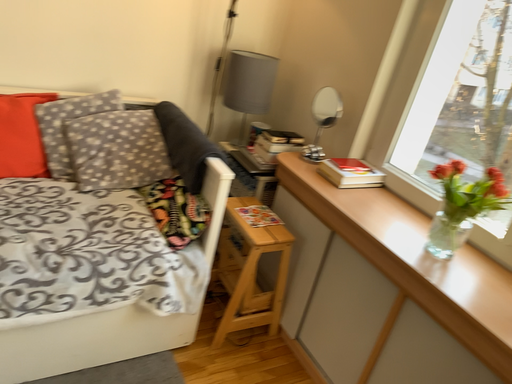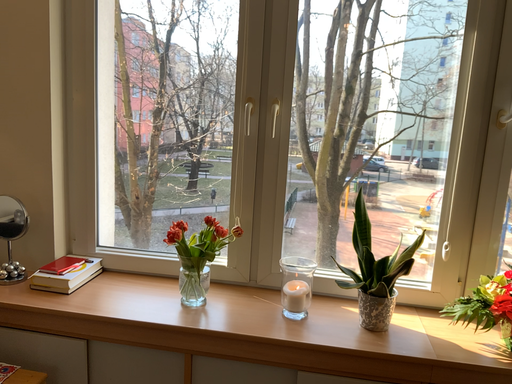
Question: How did the camera likely rotate when shooting the video?

Choices:
 (A) rotated upward
 (B) rotated downward

Answer: (A)